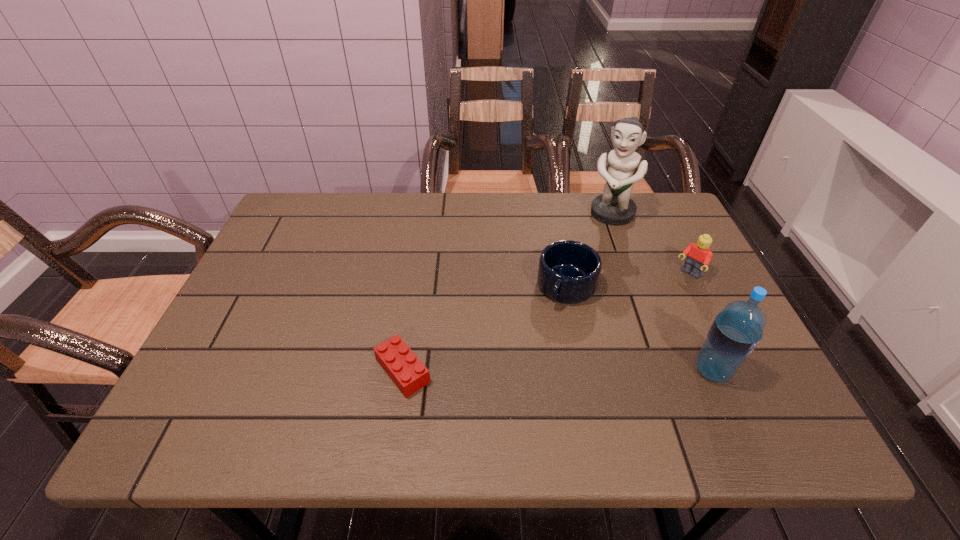
The width and height of the screenshot is (960, 540). I want to click on vacant space located 0.390m on the left of the fourth shortest object, so click(508, 370).

You are a GUI agent. You are given a task and a screenshot of the screen. Output one action in this format:
    pyautogui.click(x=<x>, y=<y>)
    Task: Click on the vacant point located 0.070m with the handle on the side of the second shortest object
    The height and width of the screenshot is (540, 960).
    Given the screenshot: What is the action you would take?
    pyautogui.click(x=545, y=329)

Identify the location of vacant space located with the handle on the side of the second shortest object. (529, 357).

Identify the location of vacant space located with the handle on the side of the second shortest object. Image resolution: width=960 pixels, height=540 pixels. (511, 389).

Locate an element on the screen. free region located 0.220m on the face of the right Lego is located at coordinates (633, 326).

You are a GUI agent. You are given a task and a screenshot of the screen. Output one action in this format:
    pyautogui.click(x=<x>, y=<y>)
    Task: Click on the free space located 0.400m on the face of the right Lego
    
    Given the screenshot: What is the action you would take?
    pyautogui.click(x=584, y=369)

You are a GUI agent. You are given a task and a screenshot of the screen. Output one action in this format:
    pyautogui.click(x=<x>, y=<y>)
    Task: Click on the vacant space located on the face of the right Lego
    
    Given the screenshot: What is the action you would take?
    pyautogui.click(x=604, y=352)

Where is `vacant position located on the front-facing side of the farthest object`? This screenshot has width=960, height=540. vacant position located on the front-facing side of the farthest object is located at coordinates (597, 238).

You are a GUI agent. You are given a task and a screenshot of the screen. Output one action in this format:
    pyautogui.click(x=<x>, y=<y>)
    Task: Click on the vacant region located 0.140m on the front-facing side of the farthest object
    This screenshot has width=960, height=540.
    Given the screenshot: What is the action you would take?
    pyautogui.click(x=588, y=254)

Where is `vacant area situated on the front-facing side of the farthest object`? This screenshot has width=960, height=540. vacant area situated on the front-facing side of the farthest object is located at coordinates (591, 248).